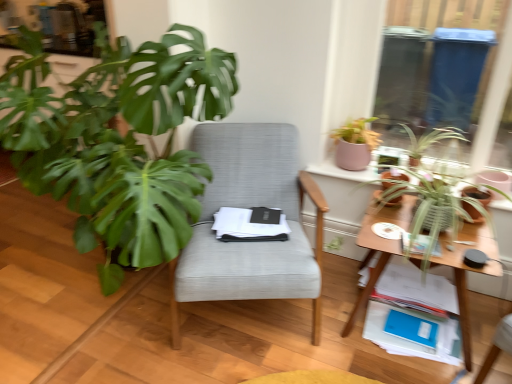
Question: In the image, is matte brown flowerpot at upper right, positioned as the 1th flowerpot in left-to-right order, positioned in front of or behind textured gray chair at center?

Choices:
 (A) front
 (B) behind

Answer: (B)

Question: Considering the positions of matte brown flowerpot at upper right, marked as the 2th flowerpot in a right-to-left arrangement, and textured gray chair at center in the image, is matte brown flowerpot at upper right, marked as the 2th flowerpot in a right-to-left arrangement, taller or shorter than textured gray chair at center?

Choices:
 (A) tall
 (B) short

Answer: (B)

Question: Which object is the closest to the pink matte pot at upper right, positioned as the 2th houseplant in left-to-right order?

Choices:
 (A) green matte plant pot at right, placed as the 1th flowerpot when sorted from right to left
 (B) textured gray chair at center
 (C) wooden table at right
 (D) leavesy green plant at right, the third houseplant viewed from the right
 (E) green leafy plant at upper right, positioned as the first houseplant in right-to-left order

Answer: (E)

Question: Estimate the real-world distances between objects in this image. Which object is farther from the green leafy plant at upper right, which is the 5th houseplant in left-to-right order?

Choices:
 (A) pink matte pot at upper right, positioned as the 2th houseplant in left-to-right order
 (B) leavesy green plant at right, the third houseplant viewed from the right
 (C) matte brown flowerpot at upper right, marked as the 2th flowerpot in a right-to-left arrangement
 (D) textured gray chair at center
 (E) green leafy plant at upper right, placed as the 4th houseplant when sorted from left to right

Answer: (D)